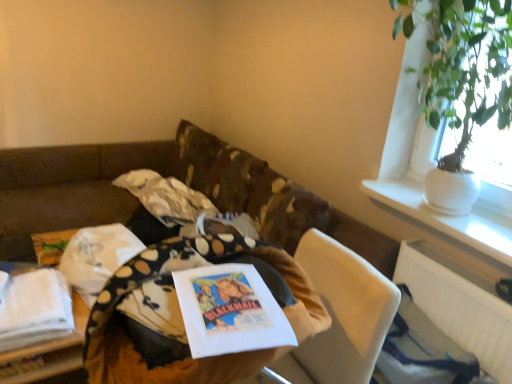
At what (x,y) coordinates should I click in order to perform the action: click on fluffy blanket at center, the 1th material in the back-to-front sequence. Please return your answer as a coordinate pair (x, y). This screenshot has height=384, width=512. Looking at the image, I should click on (165, 197).

Image resolution: width=512 pixels, height=384 pixels. Describe the element at coordinates (161, 306) in the screenshot. I see `wooden table at center, the second table positioned from the back` at that location.

Where is `white fabric swivel chair at center`? The image size is (512, 384). white fabric swivel chair at center is located at coordinates (341, 315).

What do you see at coordinates (459, 305) in the screenshot? The width and height of the screenshot is (512, 384). I see `white plastic radiator at lower right` at bounding box center [459, 305].

The width and height of the screenshot is (512, 384). Describe the element at coordinates (467, 69) in the screenshot. I see `green leafy plant in white pot at upper right` at that location.

The height and width of the screenshot is (384, 512). What do you see at coordinates (53, 354) in the screenshot? I see `white fabric at lower left, arranged as the 1th table when viewed from the back` at bounding box center [53, 354].

This screenshot has height=384, width=512. I want to click on white ceramic vase at upper right, so click(447, 217).

Image resolution: width=512 pixels, height=384 pixels. I want to click on fluffy blanket at center, the 1th material in the back-to-front sequence, so click(165, 197).

Is white ceramic vase at upper right facing towards white paper book at center?

Yes, white ceramic vase at upper right is oriented towards white paper book at center.

From the image's perspective, relative to white paper book at center, is white ceramic vase at upper right above or below?

Based on their image positions, white ceramic vase at upper right is located above white paper book at center.

From a real-world perspective, relative to white paper book at center, is white ceramic vase at upper right vertically above or below?

Clearly, from a real-world perspective, white ceramic vase at upper right is below white paper book at center.

Is white fabric at lower left, the first table from the left, inside the boundaries of wooden table at center, the second table positioned from the back, or outside?

white fabric at lower left, the first table from the left, is not inside wooden table at center, the second table positioned from the back, it's outside.

Does white fabric at lower left, arranged as the 1th table when viewed from the back, appear on the right side of wooden table at center, arranged as the 1th table when viewed from the front?

No, white fabric at lower left, arranged as the 1th table when viewed from the back, is not to the right of wooden table at center, arranged as the 1th table when viewed from the front.

Is wooden table at center, placed as the 1th table when sorted from right to left, at the back of white fabric at lower left, arranged as the 1th table when viewed from the back?

That's not correct — white fabric at lower left, arranged as the 1th table when viewed from the back, is not looking away from wooden table at center, placed as the 1th table when sorted from right to left.

From a real-world perspective, is white fabric at lower left, arranged as the 1th table when viewed from the back, under wooden table at center, which appears as the second table when viewed from the left?

Yes, from a real-world perspective, white fabric at lower left, arranged as the 1th table when viewed from the back, is under wooden table at center, which appears as the second table when viewed from the left.

Considering the points (92, 227) and (430, 249), which point is in front, point (92, 227) or point (430, 249)?

The point (430, 249) is closer to the camera.

Based on their positions, is wooden table at center, placed as the 1th table when sorted from right to left, located to the left or right of white plastic radiator at lower right?

In the image, wooden table at center, placed as the 1th table when sorted from right to left, appears on the left side of white plastic radiator at lower right.

Is wooden table at center, placed as the 1th table when sorted from right to left, oriented away from white plastic radiator at lower right?

That's right, wooden table at center, placed as the 1th table when sorted from right to left, is facing away from white plastic radiator at lower right.

Is wooden table at center, placed as the 1th table when sorted from right to left, surrounding white plastic radiator at lower right?

Definitely not — white plastic radiator at lower right is not inside wooden table at center, placed as the 1th table when sorted from right to left.

Is white fabric at lower left, the second table from the front, facing towards white ceramic vase at upper right?

No, white fabric at lower left, the second table from the front, does not turn towards white ceramic vase at upper right.

Considering the relative sizes of white fabric at lower left, arranged as the 1th table when viewed from the back, and white ceramic vase at upper right in the image provided, is white fabric at lower left, arranged as the 1th table when viewed from the back, wider than white ceramic vase at upper right?

In fact, white fabric at lower left, arranged as the 1th table when viewed from the back, might be narrower than white ceramic vase at upper right.

Find the location of `window sill on the right of white fabric at lower left, arranged as the 1th table when viewed from the back`. window sill on the right of white fabric at lower left, arranged as the 1th table when viewed from the back is located at coordinates (447, 217).

From their relative heights in the image, would you say white fabric at lower left, arranged as the 1th table when viewed from the back, is taller or shorter than white ceramic vase at upper right?

Considering their sizes, white fabric at lower left, arranged as the 1th table when viewed from the back, has more height than white ceramic vase at upper right.

Which is behind, polka dot fabric at lower left, which is the 1th material from front to back, or fluffy blanket at center, placed as the second material when sorted from front to back?

fluffy blanket at center, placed as the second material when sorted from front to back, is further away from the camera.

From a real-world perspective, is polka dot fabric at lower left, which is the 1th material from front to back, beneath fluffy blanket at center, the 1th material in the back-to-front sequence?

Yes, from a real-world perspective, polka dot fabric at lower left, which is the 1th material from front to back, is beneath fluffy blanket at center, the 1th material in the back-to-front sequence.

Is polka dot fabric at lower left, positioned as the 2th material in back-to-front order, with fluffy blanket at center, the 1th material in the back-to-front sequence?

No, polka dot fabric at lower left, positioned as the 2th material in back-to-front order, is not in contact with fluffy blanket at center, the 1th material in the back-to-front sequence.

Locate an element on the screen. material in front of the fluffy blanket at center, placed as the second material when sorted from front to back is located at coordinates (97, 257).

From the picture: Which point is more forward, [168,186] or [462,327]?

Positioned in front is point [462,327].

Considering the relative sizes of fluffy blanket at center, the 1th material in the back-to-front sequence, and white plastic radiator at lower right in the image provided, is fluffy blanket at center, the 1th material in the back-to-front sequence, bigger than white plastic radiator at lower right?

Indeed, fluffy blanket at center, the 1th material in the back-to-front sequence, has a larger size compared to white plastic radiator at lower right.

Considering the relative sizes of fluffy blanket at center, the 1th material in the back-to-front sequence, and white plastic radiator at lower right in the image provided, is fluffy blanket at center, the 1th material in the back-to-front sequence, shorter than white plastic radiator at lower right?

Yes.

Is fluffy blanket at center, the 1th material in the back-to-front sequence, next to white plastic radiator at lower right?

No, fluffy blanket at center, the 1th material in the back-to-front sequence, is not beside white plastic radiator at lower right.

Who is taller, white fabric at lower left, the second table from the front, or white plastic radiator at lower right?

Standing taller between the two is white plastic radiator at lower right.

How different are the orientations of white fabric at lower left, which is the 2th table from right to left, and white plastic radiator at lower right in degrees?

They differ by 1.9 degrees in their facing directions.

Considering the relative positions of white fabric at lower left, the second table from the front, and white plastic radiator at lower right in the image provided, is white fabric at lower left, the second table from the front, to the left or to the right of white plastic radiator at lower right?

white fabric at lower left, the second table from the front, is positioned on white plastic radiator at lower right's left side.

From the image's perspective, which one is positioned lower, white fabric at lower left, arranged as the 1th table when viewed from the back, or white plastic radiator at lower right?

white plastic radiator at lower right.

Find the location of a particular element. book above the white ceramic vase at upper right (from a real-world perspective) is located at coordinates (230, 311).

Identify the location of table located in front of the white fabric at lower left, the first table from the left. (161, 306).

From the image, which object appears to be nearer to white paper book at center, white plastic radiator at lower right or white fabric swivel chair at center?

white fabric swivel chair at center.

When comparing their distances from green leafy plant in white pot at upper right, does wooden table at center, the second table positioned from the back, or white fabric at lower left, the first table from the left, seem further?

Among the two, white fabric at lower left, the first table from the left, is located further to green leafy plant in white pot at upper right.

In the scene shown: From the image, which object appears to be farther from white fabric swivel chair at center, fluffy blanket at center, the 1th material in the back-to-front sequence, or polka dot fabric at lower left, which is the 1th material from front to back?

The object further to white fabric swivel chair at center is fluffy blanket at center, the 1th material in the back-to-front sequence.

Looking at the image, which one is located closer to polka dot fabric at lower left, positioned as the 2th material in back-to-front order, white fabric at lower left, which is the 2th table from right to left, or white paper book at center?

white fabric at lower left, which is the 2th table from right to left, lies closer to polka dot fabric at lower left, positioned as the 2th material in back-to-front order, than the other object.

When comparing their distances from green leafy plant in white pot at upper right, does white fabric swivel chair at center or white fabric at lower left, the second table from the front, seem further?

white fabric at lower left, the second table from the front, is further to green leafy plant in white pot at upper right.

Which object lies nearer to the anchor point white paper book at center, fluffy blanket at center, the 1th material in the back-to-front sequence, or white fabric swivel chair at center?

white fabric swivel chair at center.

Considering their positions, is fluffy blanket at center, placed as the second material when sorted from front to back, positioned closer to white plastic radiator at lower right than white fabric swivel chair at center?

white fabric swivel chair at center.

Based on their spatial positions, is fluffy blanket at center, the 1th material in the back-to-front sequence, or white paper book at center further from white plastic radiator at lower right?

fluffy blanket at center, the 1th material in the back-to-front sequence, lies further to white plastic radiator at lower right than the other object.

In order to click on radiator between white fabric at lower left, the first table from the left, and white ceramic vase at upper right, in the horizontal direction in this screenshot , I will do `click(459, 305)`.

This screenshot has width=512, height=384. In order to click on radiator between white paper book at center and white ceramic vase at upper right in this screenshot , I will do `click(459, 305)`.

You are a GUI agent. You are given a task and a screenshot of the screen. Output one action in this format:
    pyautogui.click(x=<x>, y=<y>)
    Task: Click on the book situated between white fabric at lower left, the second table from the front, and white plastic radiator at lower right from left to right
    This screenshot has height=384, width=512.
    Given the screenshot: What is the action you would take?
    pyautogui.click(x=230, y=311)

Image resolution: width=512 pixels, height=384 pixels. In order to click on radiator situated between polka dot fabric at lower left, which is the 1th material from front to back, and white ceramic vase at upper right from left to right in this screenshot , I will do `click(459, 305)`.